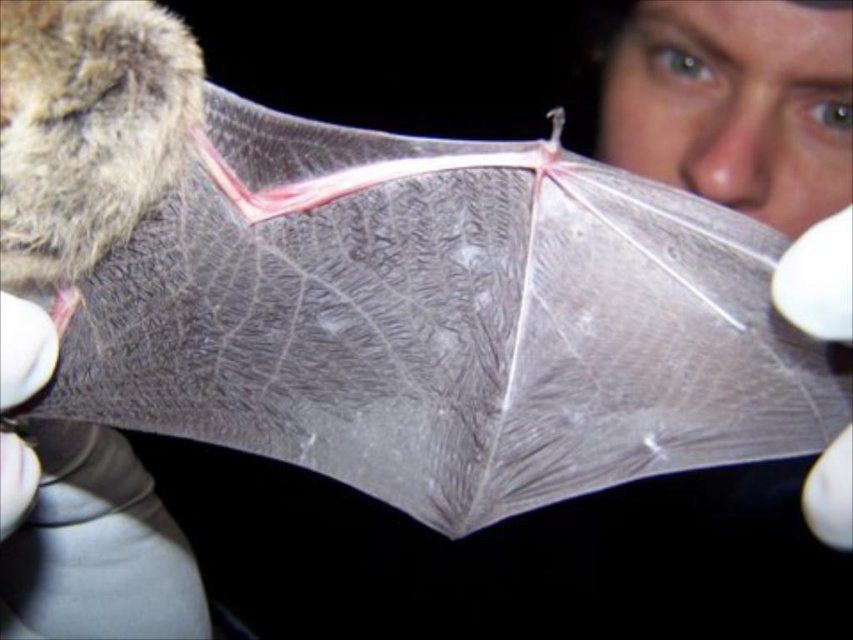
Who is taller, white matte glove at right or white matte glove at lower left?

white matte glove at right is taller.

Who is higher up, white matte glove at right or white matte glove at lower left?

Positioned higher is white matte glove at right.

Is point (820, 314) closer to camera compared to point (51, 332)?

That is True.

This screenshot has height=640, width=853. I want to click on white matte glove at right, so click(817, 280).

You are a GUI agent. You are given a task and a screenshot of the screen. Output one action in this format:
    pyautogui.click(x=<x>, y=<y>)
    Task: Click on the white matte glove at right
    
    Given the screenshot: What is the action you would take?
    pyautogui.click(x=817, y=280)

Does smooth skin nose at center have a greater height compared to white matte glove at lower left?

Indeed, smooth skin nose at center has a greater height compared to white matte glove at lower left.

Between point (688, 148) and point (3, 348), which one is positioned behind?

Point (688, 148)

Measure the distance between smooth skin nose at center and camera.

The distance of smooth skin nose at center from camera is 1.25 meters.

This screenshot has height=640, width=853. Find the location of `smooth skin nose at center`. smooth skin nose at center is located at coordinates (730, 141).